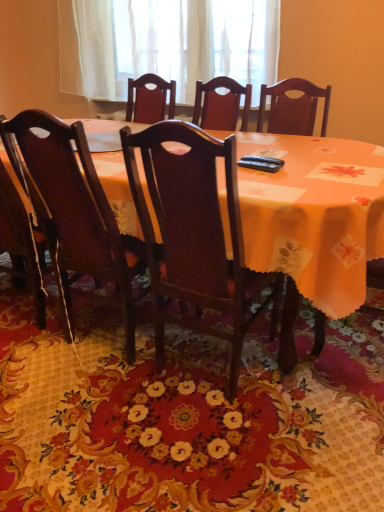
The height and width of the screenshot is (512, 384). In order to click on free space in front of dark wood chair at center, placed as the 1th chair when sorted from right to left in this screenshot , I will do `click(228, 455)`.